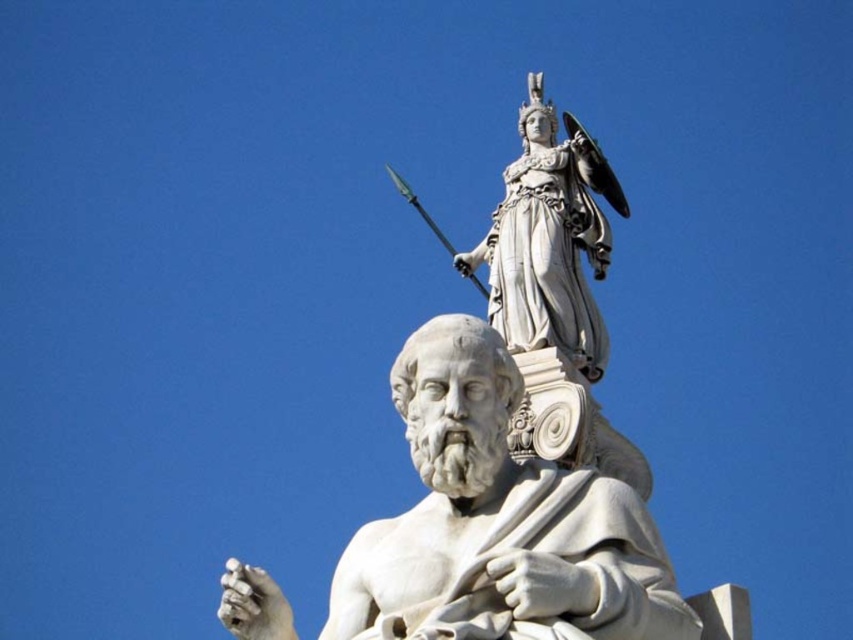
Question: Where is white marble statue at center located in relation to white marble statue at upper center in the image?

Choices:
 (A) below
 (B) above

Answer: (A)

Question: Which point is farther from the camera taking this photo?

Choices:
 (A) (498, 216)
 (B) (379, 620)

Answer: (A)

Question: Considering the relative positions of white marble statue at center and white marble statue at upper center in the image provided, where is white marble statue at center located with respect to white marble statue at upper center?

Choices:
 (A) above
 (B) below

Answer: (B)

Question: Which object appears closest to the camera in this image?

Choices:
 (A) white marble statue at center
 (B) white marble statue at upper center

Answer: (A)

Question: Is white marble statue at center further to the viewer compared to white marble statue at upper center?

Choices:
 (A) yes
 (B) no

Answer: (B)